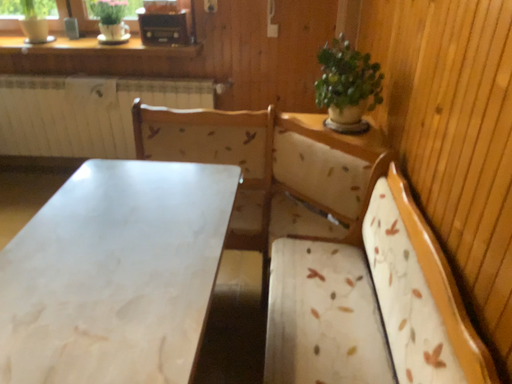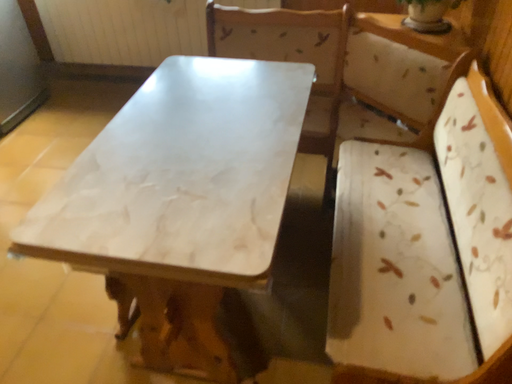
Question: Which way did the camera rotate in the video?

Choices:
 (A) rotated left
 (B) rotated right

Answer: (A)